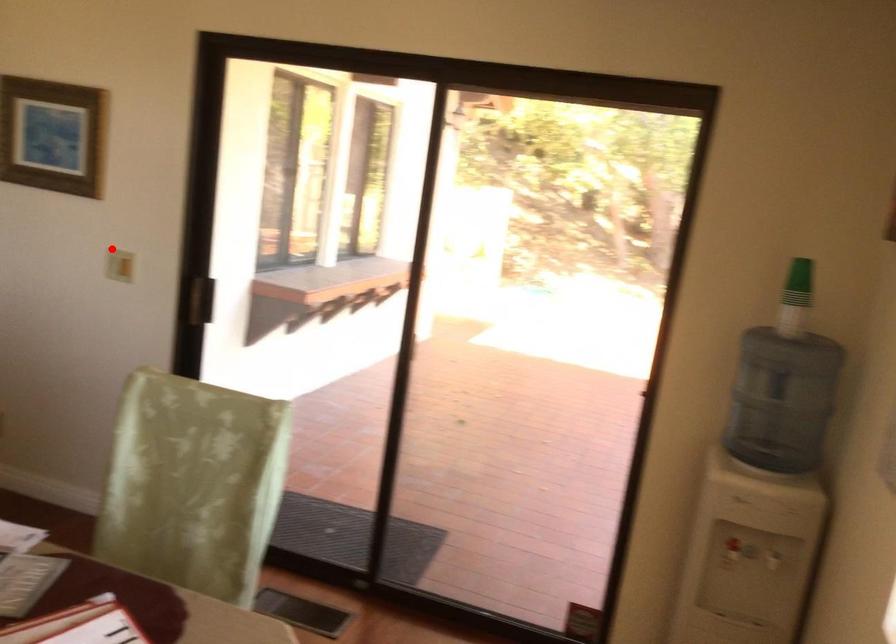
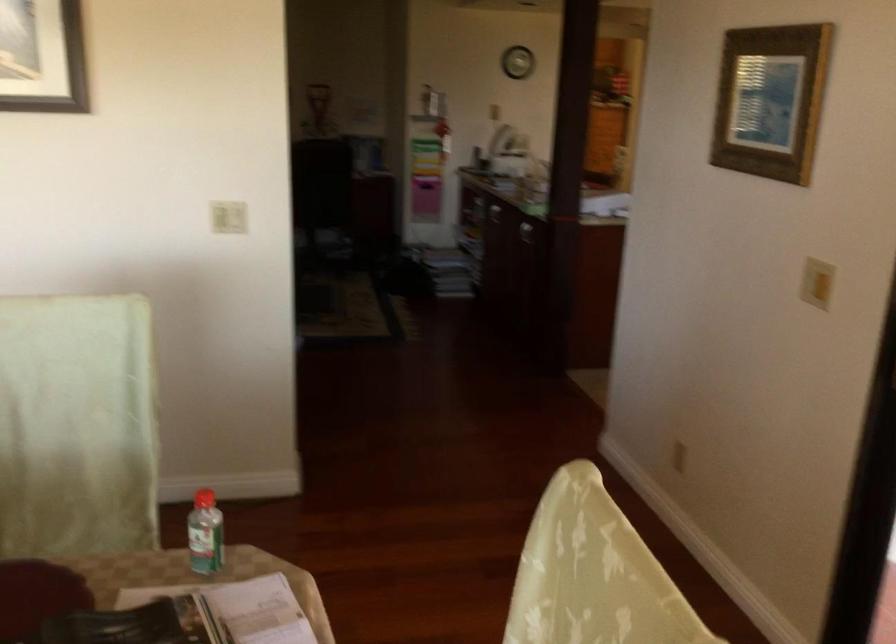
Question: A red point is marked in image1. In image2, is the corresponding 3D point closer to the camera or farther? Reply with the corresponding letter.

Choices:
 (A) The corresponding 3D point is closer.
 (B) The corresponding 3D point is farther.

Answer: (A)